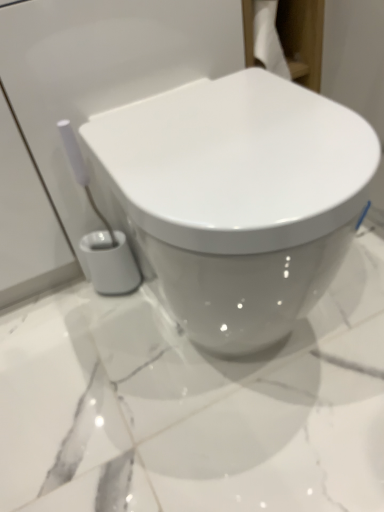
What are the coordinates of `free space above white glossy toilet at center (from a real-world perspective)` in the screenshot? It's located at tap(225, 126).